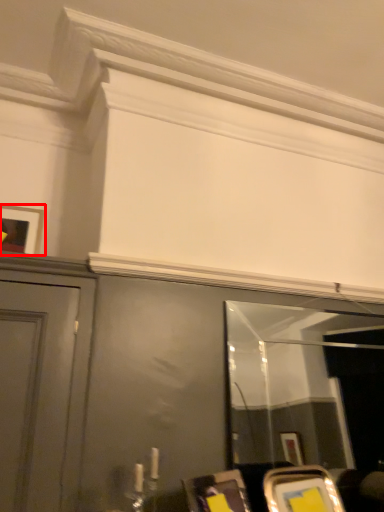
Question: From the image's perspective, where is picture frame (annotated by the red box) located in relation to mirror in the image?

Choices:
 (A) above
 (B) below

Answer: (A)